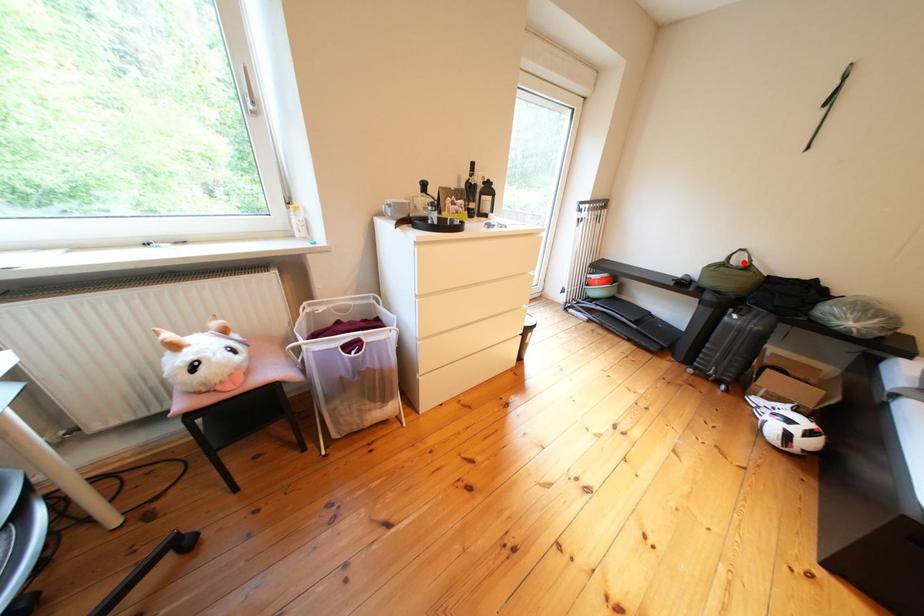
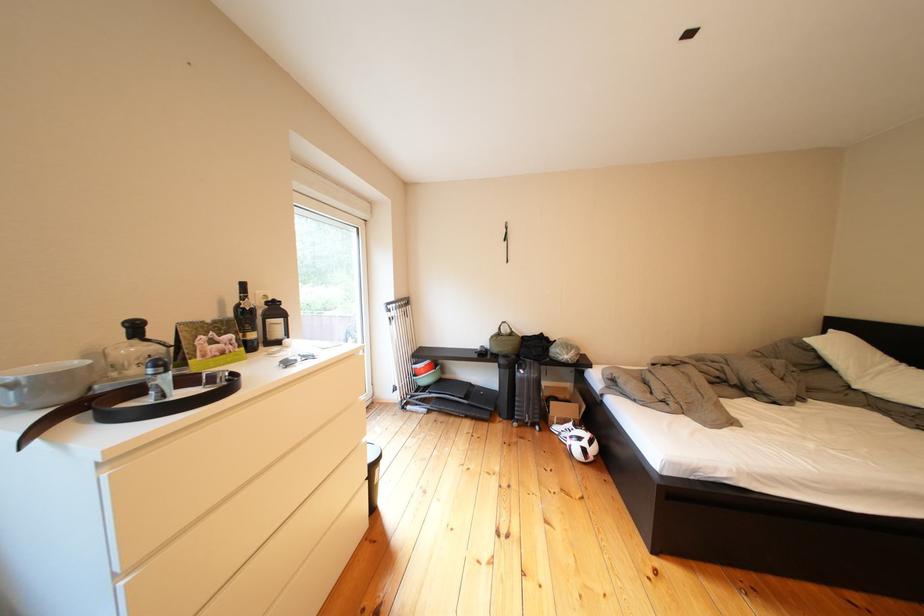
The point at the highlighted location is marked in the first image. Where is the corresponding point in the second image?

(514, 334)